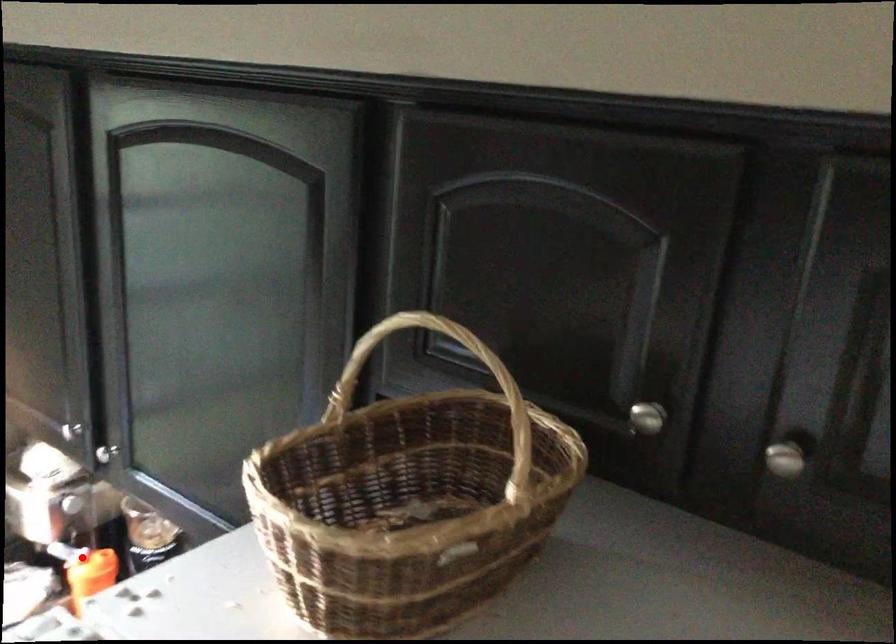
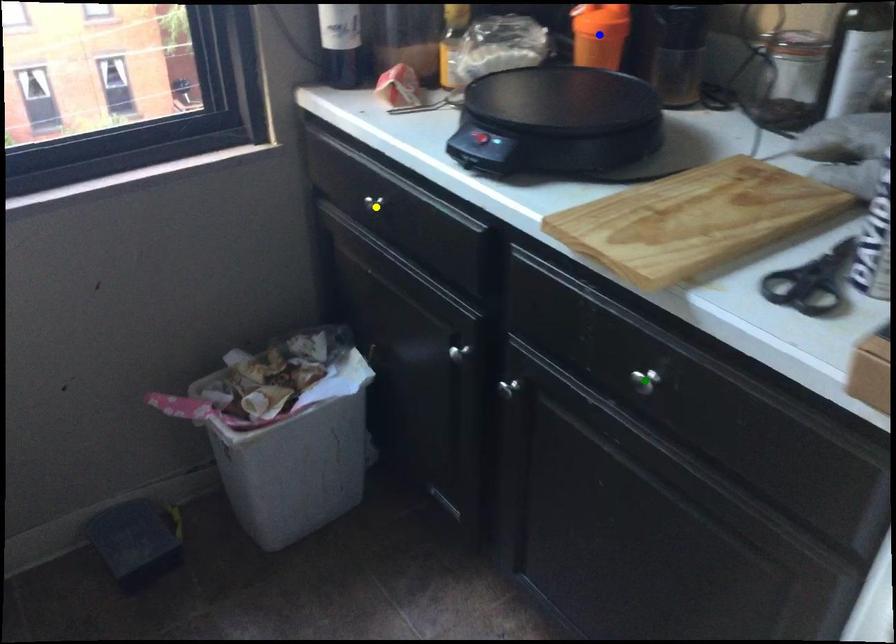
Question: I am providing you with two images of the same scene from different viewpoints. A red point is marked on the first image. You are given multiple points on the second image. Which point in image 2 is actually the same real-world point as the red point in image 1?

Choices:
 (A) yellow point
 (B) green point
 (C) blue point

Answer: (C)